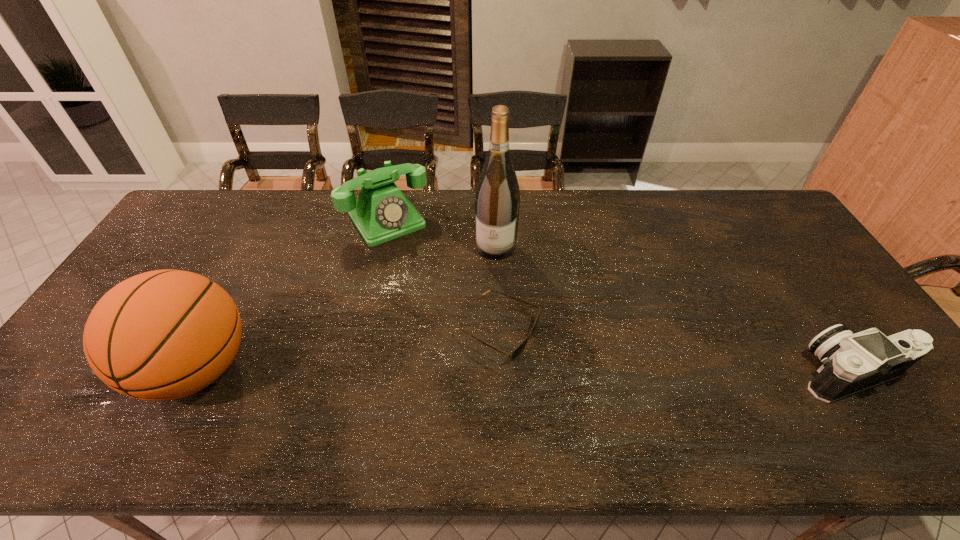
The image size is (960, 540). I want to click on object that is the second closest one to the rightmost object, so 497,201.

Where is `object that is the second closest to the fourth object from right to left`? This screenshot has width=960, height=540. object that is the second closest to the fourth object from right to left is located at coordinates (519, 349).

I want to click on vacant space that satisfies the following two spatial constraints: 1. on the front side of the tallest object; 2. on the left side of the fourth tallest object, so click(500, 373).

Locate an element on the screen. vacant space that satisfies the following two spatial constraints: 1. on the back side of the tallest object; 2. on the left side of the shortest object is located at coordinates (494, 247).